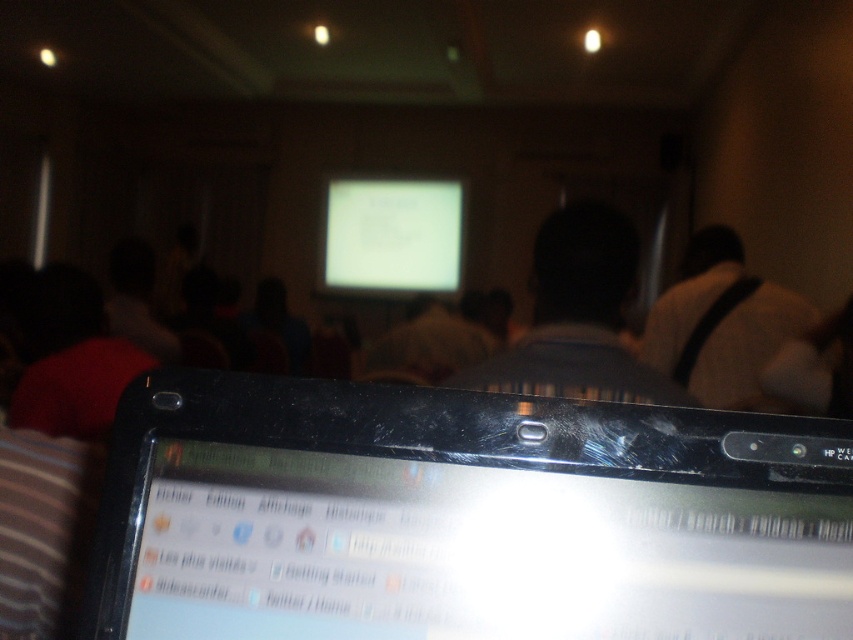
You are organizing a presentation and need to place the matte black laptop at center and the white fabric bag at upper right on a table. Based on their sizes, which object should you place first to ensure stability?

The matte black laptop at center should be placed first because it is shorter than the white fabric bag at upper right, allowing the taller bag to be positioned without toppling over.

In the scene shown: You are an attendee at a presentation and want to place your white fabric bag at upper right on the table next to the white glossy screen at center. Can you do that without moving the screen?

The white fabric bag at upper right is already positioned to the right of the white glossy screen at center, so you can place it there without moving the screen.

You are an attendee at a presentation and need to place your white fabric bag at upper right on the table. However, there is a white glossy screen at center in the way. Can you move the bag without touching the screen?

The white fabric bag at upper right is located below the white glossy screen at center, so you can move the bag without touching the screen by moving it sideways or lifting it carefully underneath the screen.